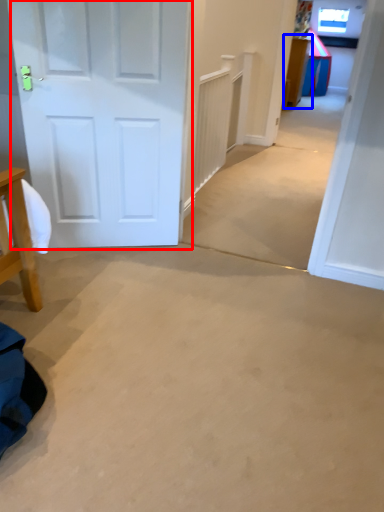
Question: Which object is further to the camera taking this photo, door (highlighted by a red box) or table (highlighted by a blue box)?

Choices:
 (A) door
 (B) table

Answer: (B)